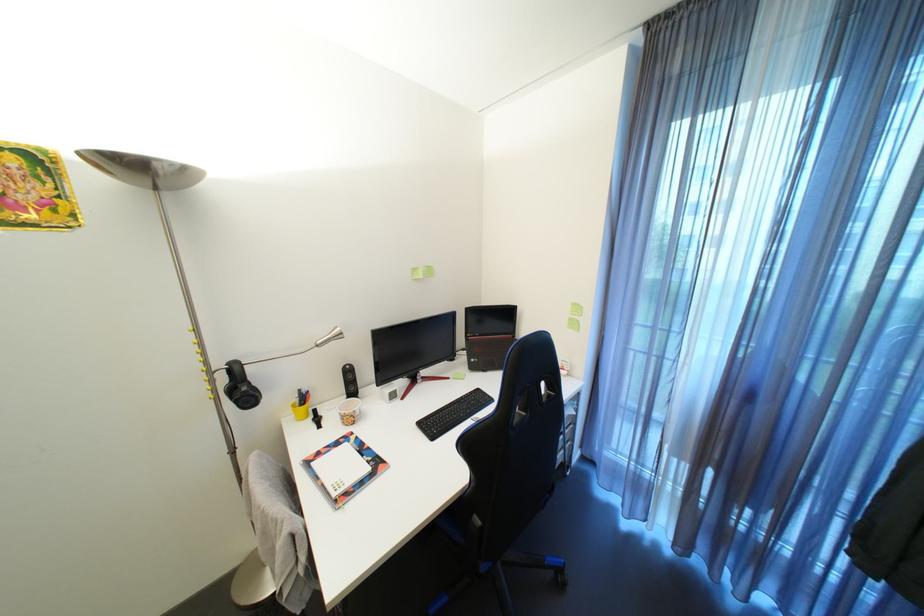
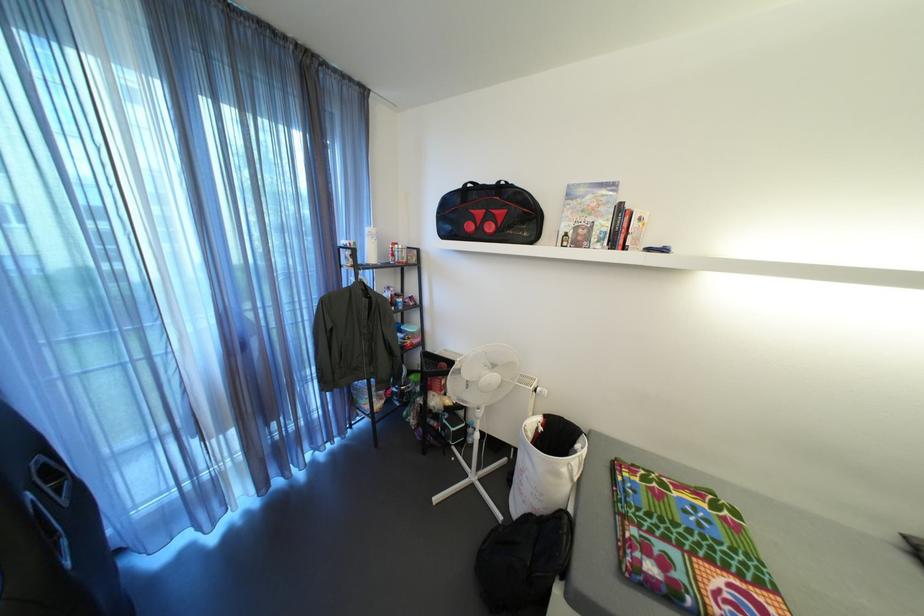
How did the camera likely rotate?

The rotation direction of the camera is right-down.